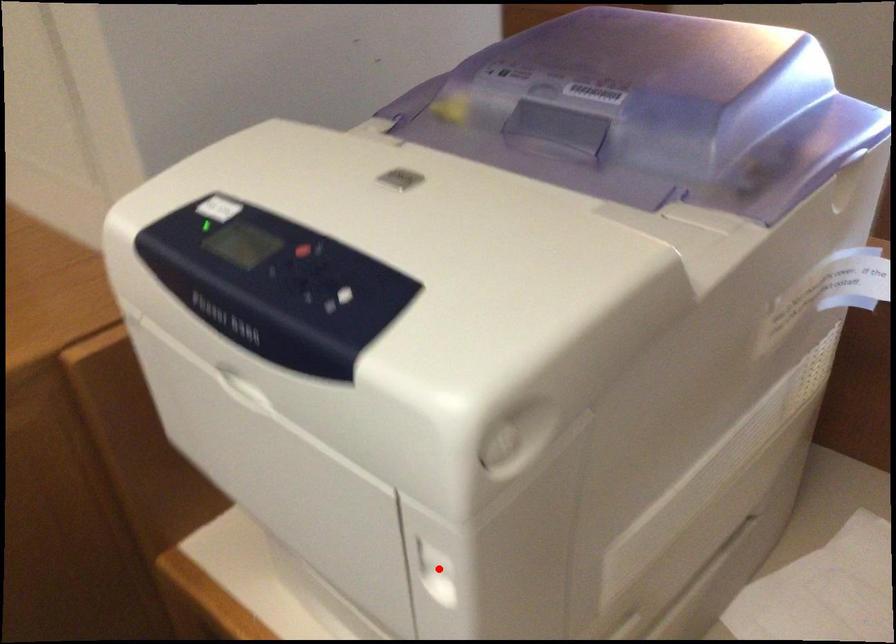
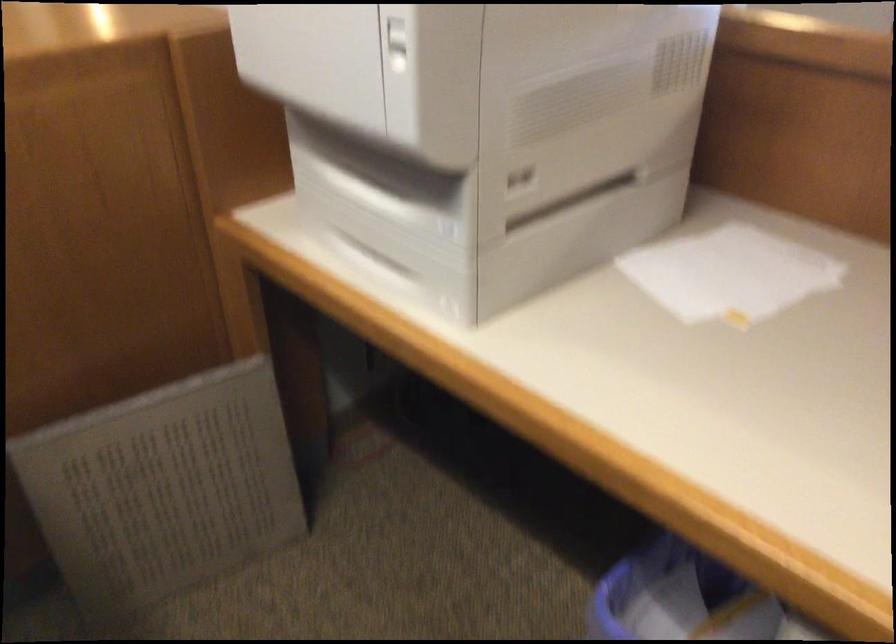
Locate, in the second image, the point that corresponds to the highlighted location in the first image.

(397, 44)